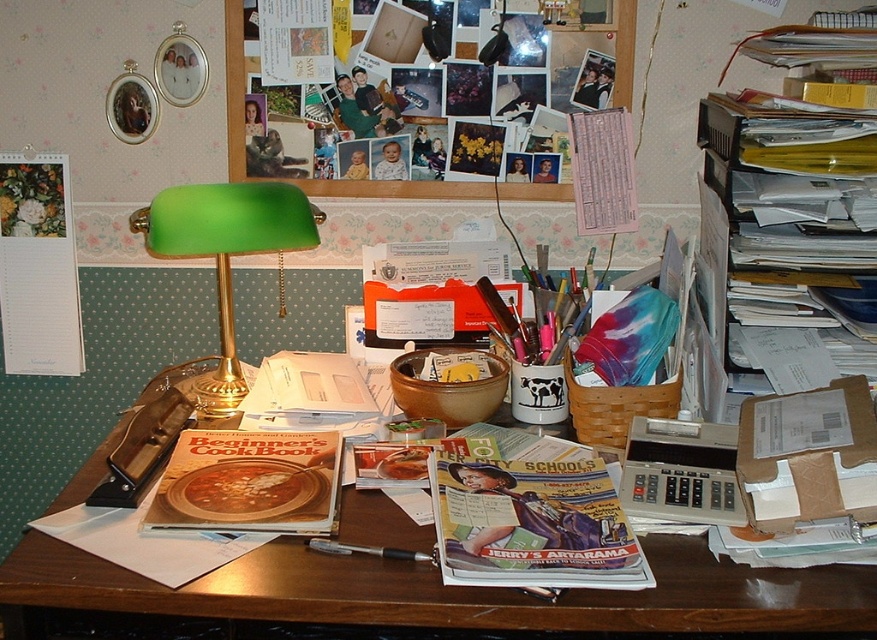
You need to read the matte paper cookbook at center under good lighting. Is the green glass lamp at left positioned in a way that it can illuminate the cookbook effectively?

The matte paper cookbook at center is positioned under the green glass lamp at left, so the lamp is directly above it and should provide sufficient light for reading.

What object is located at the coordinates point (141, 451) on the desk?

The wooden cutting board at center is located at point (141, 451) on the desk.